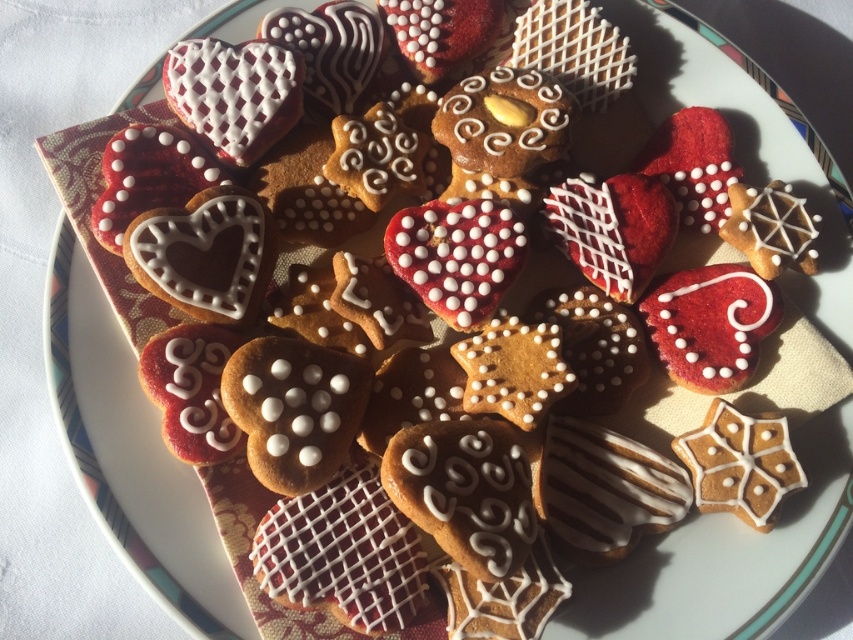
Question: Can you confirm if golden sugar-coated star at center is thinner than white sugar-coated star at center?

Choices:
 (A) no
 (B) yes

Answer: (B)

Question: Based on their relative distances, which object is farther from the white sugar-coated star at center?

Choices:
 (A) golden sugar-coated star at center
 (B) white icing gingerbread at center
 (C) matte white star at upper right

Answer: (C)

Question: Is white icing gingerbread at center behind golden sugar-coated star at center?

Choices:
 (A) yes
 (B) no

Answer: (B)

Question: Estimate the real-world distances between objects in this image. Which object is closer to the golden sugar-coated star at center?

Choices:
 (A) white sugar-coated star at center
 (B) matte white star at upper right
 (C) white icing gingerbread at center

Answer: (A)

Question: Estimate the real-world distances between objects in this image. Which object is farther from the white icing gingerbread at center?

Choices:
 (A) matte white star at upper right
 (B) golden sugar-coated star at center

Answer: (A)

Question: Does white sugar-coated star at center appear over matte white star at upper right?

Choices:
 (A) yes
 (B) no

Answer: (B)